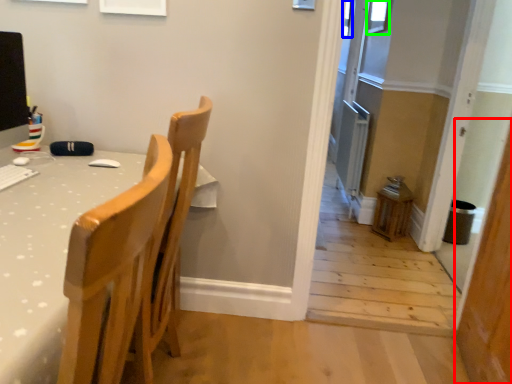
Question: Which object is positioned farthest from screen door (highlighted by a red box)? Select from window (highlighted by a blue box) and window (highlighted by a green box).

Choices:
 (A) window
 (B) window

Answer: (B)